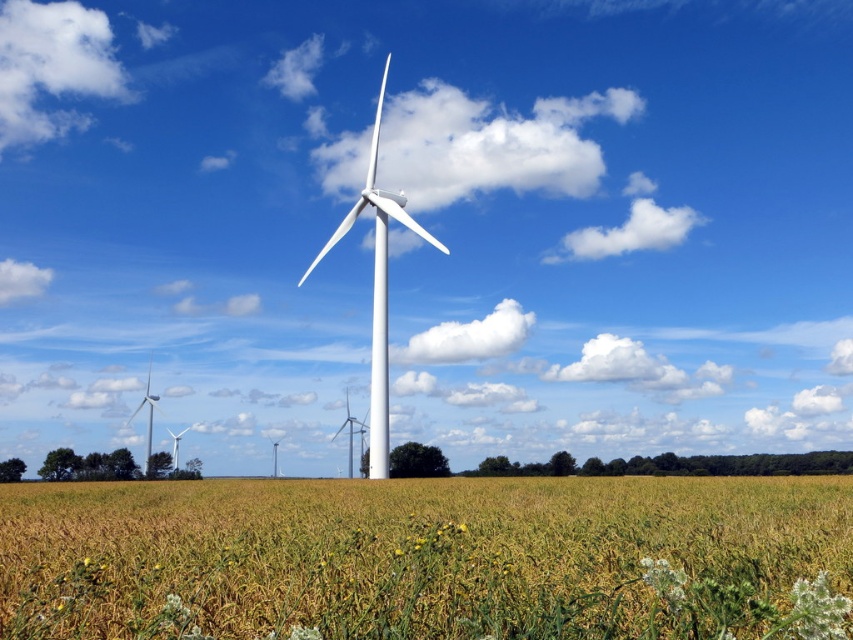
You are a drone operator planning to fly a drone between the yellow grass at center and the white matte wind turbine at center. The drone has a maximum flight distance of 50 meters. Can the drone safely make the trip between them?

The yellow grass at center and the white matte wind turbine at center are 47.77 meters apart from each other. Since the distance is within the drone operator maximum flight distance of 50 meters, the drone can safely make the trip between them.

You are standing in the middle of the field of golden crops looking towards the wind turbines. There is a point marked at coordinates (x=428, y=557). What is located at that point?

The point at coordinates (x=428, y=557) corresponds to yellow grass at center.

From the picture: You are a drone operator flying a drone over a rural landscape. Your drone is currently above the yellow grass at center and you want to capture a photo of the white matte wind turbine at center. Can you fly the drone upwards from its current position to get a clear shot of the wind turbine without any obstruction?

The yellow grass at center is positioned under the white matte wind turbine at center, so flying the drone upwards from the yellow grass at center would allow you to capture the white matte wind turbine at center without obstruction as it is above the grass.